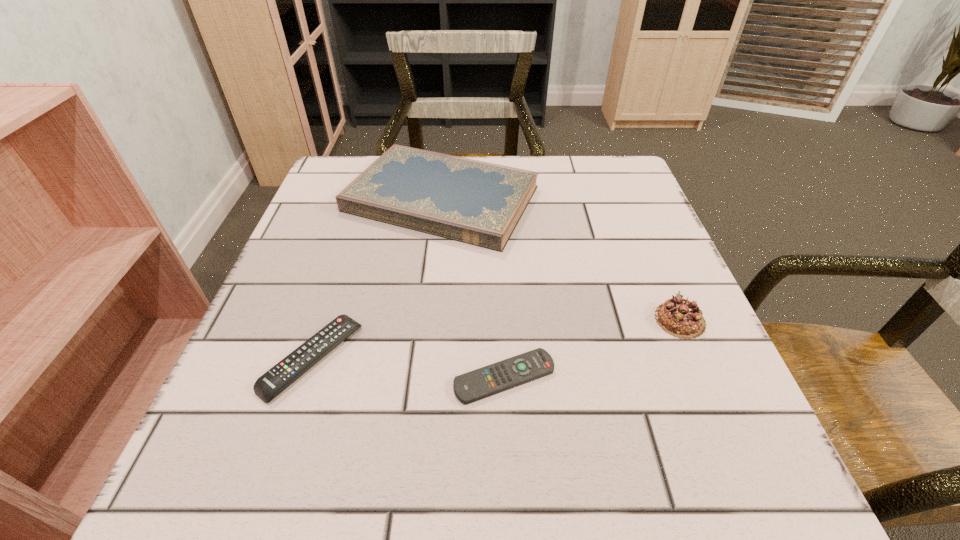
In the image, there is a desktop. Identify the location of free space at the far right corner. (588, 160).

Locate an element on the screen. The width and height of the screenshot is (960, 540). unoccupied position between the chocolate cake and the left remote control is located at coordinates (496, 339).

You are a GUI agent. You are given a task and a screenshot of the screen. Output one action in this format:
    pyautogui.click(x=<x>, y=<y>)
    Task: Click on the free space between the rightmost object and the shorter remote control
    This screenshot has width=960, height=540.
    Given the screenshot: What is the action you would take?
    pyautogui.click(x=592, y=348)

Locate an element on the screen. free spot between the rightmost object and the second shortest object is located at coordinates (496, 339).

I want to click on free space between the taller remote control and the shortest object, so click(408, 368).

The height and width of the screenshot is (540, 960). Identify the location of vacant point located between the rightmost object and the right remote control. (592, 348).

Identify the location of free spot between the chocolate cake and the shorter remote control. (592, 348).

At what (x,y) coordinates should I click in order to perform the action: click on blank region between the rightmost object and the shortest object. Please return your answer as a coordinate pair (x, y). The height and width of the screenshot is (540, 960). Looking at the image, I should click on (592, 348).

Find the location of a particular element. The image size is (960, 540). free space between the third tallest object and the shortest object is located at coordinates (408, 368).

This screenshot has height=540, width=960. I want to click on vacant area that lies between the shorter remote control and the taller remote control, so click(x=408, y=368).